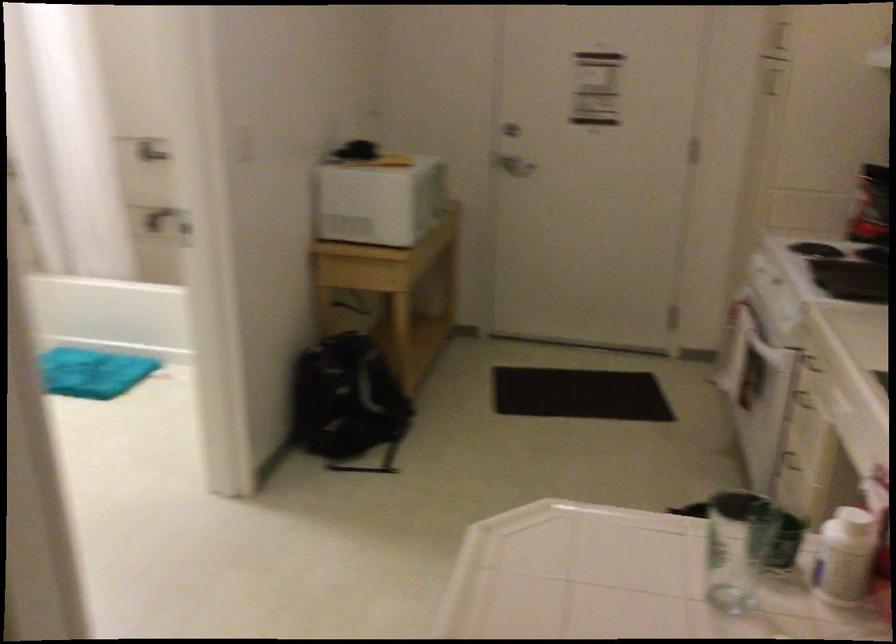
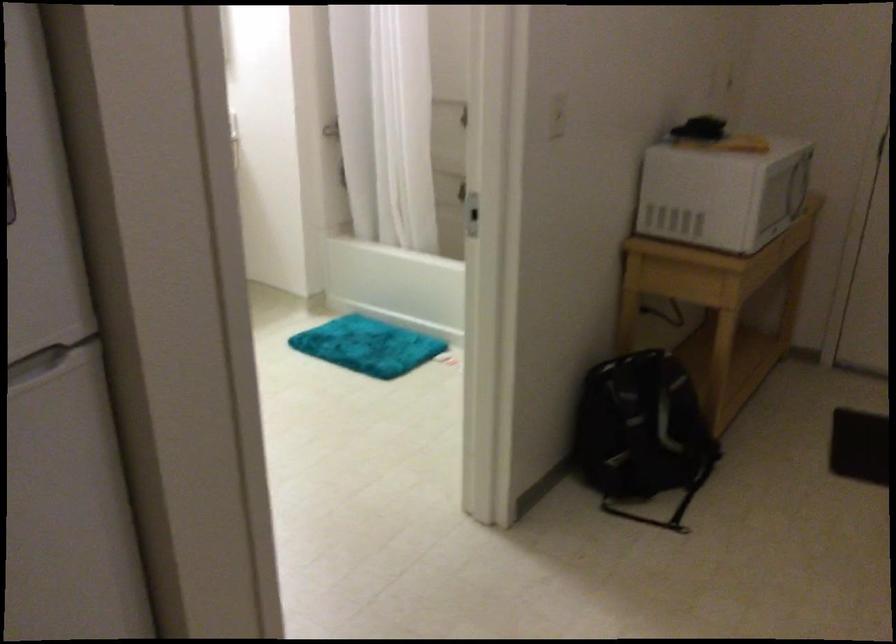
Question: What movement of the cameraman would produce the second image?

Choices:
 (A) Left
 (B) Right
 (C) Forward
 (D) Backward

Answer: (C)